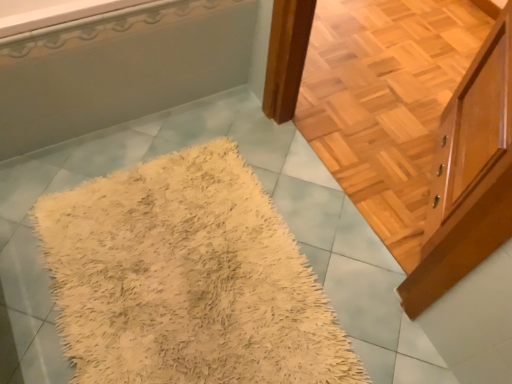
Describe the element at coordinates (469, 175) in the screenshot. I see `light brown wood cabinet at upper right` at that location.

At what (x,y) coordinates should I click in order to perform the action: click on white glossy bathtub at upper left. Please return your answer as a coordinate pair (x, y). Looking at the image, I should click on click(120, 70).

You are a GUI agent. You are given a task and a screenshot of the screen. Output one action in this format:
    pyautogui.click(x=<x>, y=<y>)
    Task: Click on the light brown wood cabinet at upper right
    
    Given the screenshot: What is the action you would take?
    pyautogui.click(x=469, y=175)

From a real-world perspective, does white glossy bathtub at upper left sit lower than beige shaggy rug at center?

Incorrect, from a real-world perspective, white glossy bathtub at upper left is higher than beige shaggy rug at center.

Which is behind, point (70, 41) or point (94, 210)?

The point (94, 210) is behind.

Is white glossy bathtub at upper left positioned with its back to beige shaggy rug at center?

No, white glossy bathtub at upper left's orientation is not away from beige shaggy rug at center.

Considering the sizes of objects white glossy bathtub at upper left and beige shaggy rug at center in the image provided, who is smaller, white glossy bathtub at upper left or beige shaggy rug at center?

With smaller size is beige shaggy rug at center.

Is beige shaggy rug at center positioned beyond the bounds of light brown wood cabinet at upper right?

Absolutely, beige shaggy rug at center is external to light brown wood cabinet at upper right.

Based on the photo, from the image's perspective, is beige shaggy rug at center located above light brown wood cabinet at upper right?

Incorrect, from the image's perspective, beige shaggy rug at center is lower than light brown wood cabinet at upper right.

Could you tell me if beige shaggy rug at center is facing light brown wood cabinet at upper right?

No, beige shaggy rug at center is not facing towards light brown wood cabinet at upper right.

Are light brown wood cabinet at upper right and white glossy bathtub at upper left located far from each other?

Yes, light brown wood cabinet at upper right is far from white glossy bathtub at upper left.

Between light brown wood cabinet at upper right and white glossy bathtub at upper left, which one has smaller size?

light brown wood cabinet at upper right.

Considering the relative sizes of light brown wood cabinet at upper right and white glossy bathtub at upper left in the image provided, is light brown wood cabinet at upper right wider than white glossy bathtub at upper left?

In fact, light brown wood cabinet at upper right might be narrower than white glossy bathtub at upper left.

Is white glossy bathtub at upper left positioned with its back to light brown wood cabinet at upper right?

No.

From the image's perspective, is white glossy bathtub at upper left under light brown wood cabinet at upper right?

Incorrect, from the image's perspective, white glossy bathtub at upper left is higher than light brown wood cabinet at upper right.

From a real-world perspective, is white glossy bathtub at upper left physically below light brown wood cabinet at upper right?

Yes, from a real-world perspective, white glossy bathtub at upper left is beneath light brown wood cabinet at upper right.

Considering their positions, is beige shaggy rug at center located in front of or behind white glossy bathtub at upper left?

In the image, beige shaggy rug at center appears in front of white glossy bathtub at upper left.

Could white glossy bathtub at upper left be considered to be inside beige shaggy rug at center?

No, white glossy bathtub at upper left is not surrounded by beige shaggy rug at center.

From a real-world perspective, which is physically above, beige shaggy rug at center or white glossy bathtub at upper left?

In real-world perspective, white glossy bathtub at upper left is above.

Consider the image. In the image, is beige shaggy rug at center on the left side or the right side of white glossy bathtub at upper left?

beige shaggy rug at center is positioned on white glossy bathtub at upper left's right side.

Does point (470, 215) come in front of point (100, 335)?

Yes, point (470, 215) is closer to viewer.

Looking at this image, is light brown wood cabinet at upper right next to beige shaggy rug at center?

No, light brown wood cabinet at upper right is not beside beige shaggy rug at center.

From a real-world perspective, is light brown wood cabinet at upper right physically located above or below beige shaggy rug at center?

Clearly, from a real-world perspective, light brown wood cabinet at upper right is above beige shaggy rug at center.

Between light brown wood cabinet at upper right and beige shaggy rug at center, which one appears on the right side from the viewer's perspective?

light brown wood cabinet at upper right.

The image size is (512, 384). In order to click on bathtub above the beige shaggy rug at center (from a real-world perspective) in this screenshot , I will do `click(120, 70)`.

Where is `mat directly beneath the light brown wood cabinet at upper right (from a real-world perspective)`? mat directly beneath the light brown wood cabinet at upper right (from a real-world perspective) is located at coordinates (187, 279).

From the image, which object appears to be farther from beige shaggy rug at center, light brown wood cabinet at upper right or white glossy bathtub at upper left?

light brown wood cabinet at upper right.

Looking at the image, which one is located further to white glossy bathtub at upper left, beige shaggy rug at center or light brown wood cabinet at upper right?

The object further to white glossy bathtub at upper left is light brown wood cabinet at upper right.

Looking at the image, which one is located closer to light brown wood cabinet at upper right, beige shaggy rug at center or white glossy bathtub at upper left?

The object closer to light brown wood cabinet at upper right is beige shaggy rug at center.

Considering their positions, is white glossy bathtub at upper left positioned further to beige shaggy rug at center than light brown wood cabinet at upper right?

Based on the image, light brown wood cabinet at upper right appears to be further to beige shaggy rug at center.

Estimate the real-world distances between objects in this image. Which object is closer to light brown wood cabinet at upper right, white glossy bathtub at upper left or beige shaggy rug at center?

Based on the image, beige shaggy rug at center appears to be nearer to light brown wood cabinet at upper right.

Considering their positions, is light brown wood cabinet at upper right positioned further to white glossy bathtub at upper left than beige shaggy rug at center?

light brown wood cabinet at upper right is positioned further to the anchor white glossy bathtub at upper left.

Locate an element on the screen. The image size is (512, 384). mat between white glossy bathtub at upper left and light brown wood cabinet at upper right from left to right is located at coordinates (187, 279).